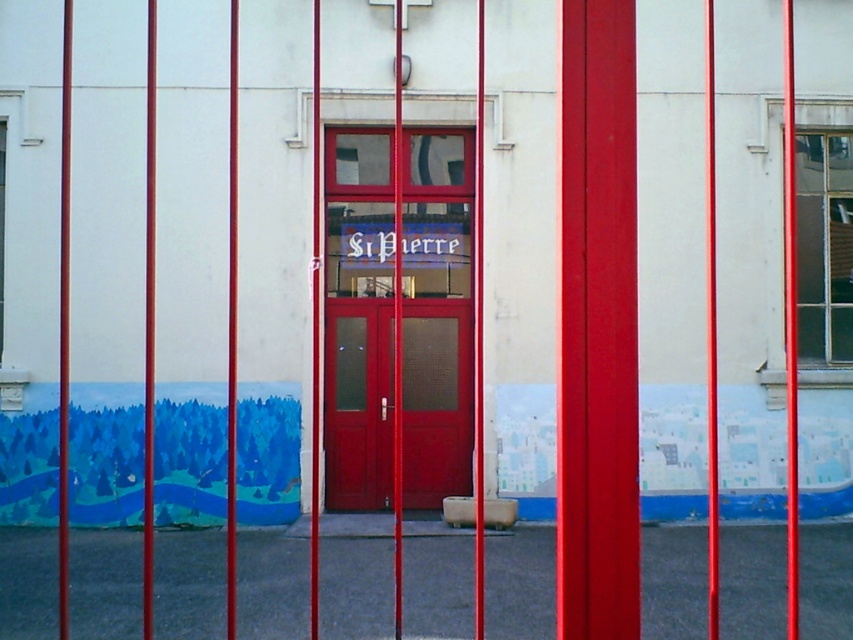
Question: Among these points, which one is nearest to the camera?

Choices:
 (A) (428, 422)
 (B) (837, 106)

Answer: (A)

Question: Which point is farther to the camera?

Choices:
 (A) matte red door at center
 (B) clear glass window at upper right

Answer: (B)

Question: Does matte red door at center appear on the left side of clear glass window at upper right?

Choices:
 (A) no
 (B) yes

Answer: (B)

Question: Does matte red door at center appear over clear glass window at upper right?

Choices:
 (A) yes
 (B) no

Answer: (B)

Question: Does matte red door at center have a lesser width compared to clear glass window at upper right?

Choices:
 (A) no
 (B) yes

Answer: (A)

Question: Which point is farther to the camera?

Choices:
 (A) matte red door at center
 (B) clear glass window at upper right

Answer: (B)